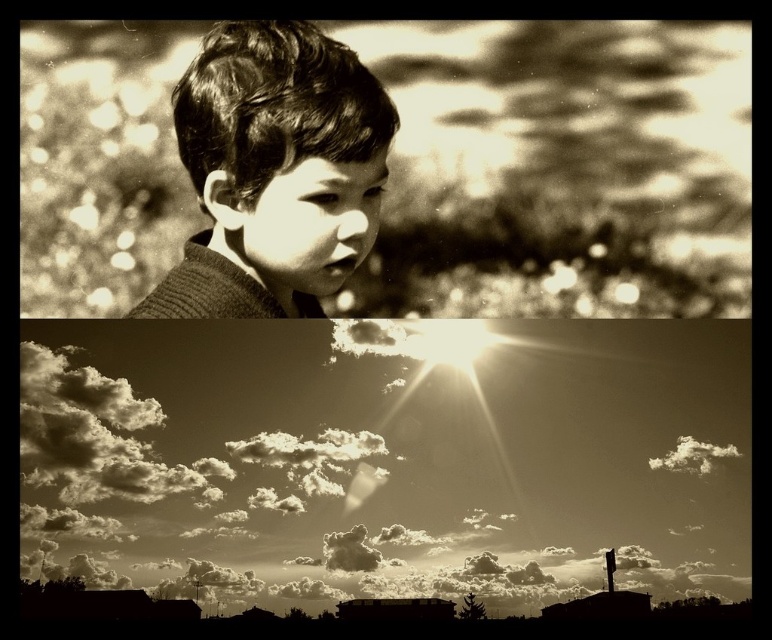
You are an artist analyzing this image. You notice the cloudy sky at upper center and the fuzzy white cloud at upper center. Which of these two elements is located higher in the composition?

The fuzzy white cloud at upper center is higher because the cloudy sky at upper center is positioned under it.

You are an artist analyzing the image. You notice the matte black hair at upper center and the fuzzy white cloud at upper center. Which object is positioned higher in the image?

The matte black hair at upper center is taller than the fuzzy white cloud at upper center, so it is positioned higher.